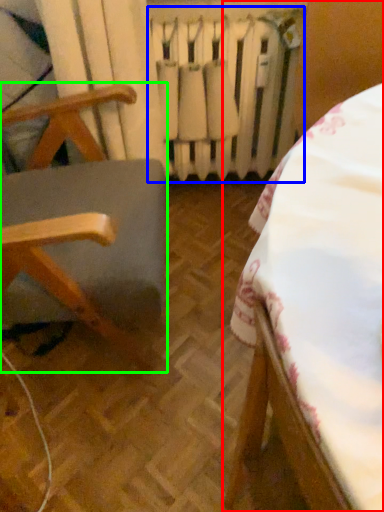
Question: Considering the real-world distances, which object is farthest from furniture (highlighted by a red box)? radiator (highlighted by a blue box) or furniture (highlighted by a green box)?

Choices:
 (A) radiator
 (B) furniture

Answer: (A)